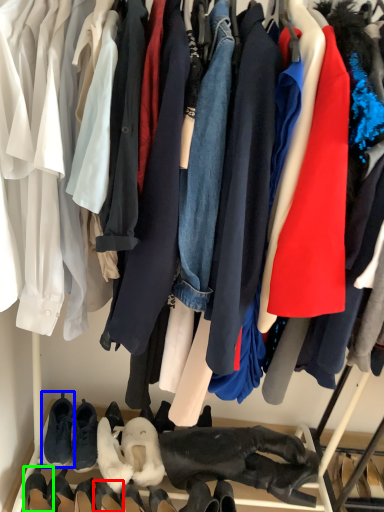
Question: Estimate the real-world distances between objects in this image. Which object is farther from footwear (highlighted by a red box), footwear (highlighted by a blue box) or footwear (highlighted by a green box)?

Choices:
 (A) footwear
 (B) footwear

Answer: (A)